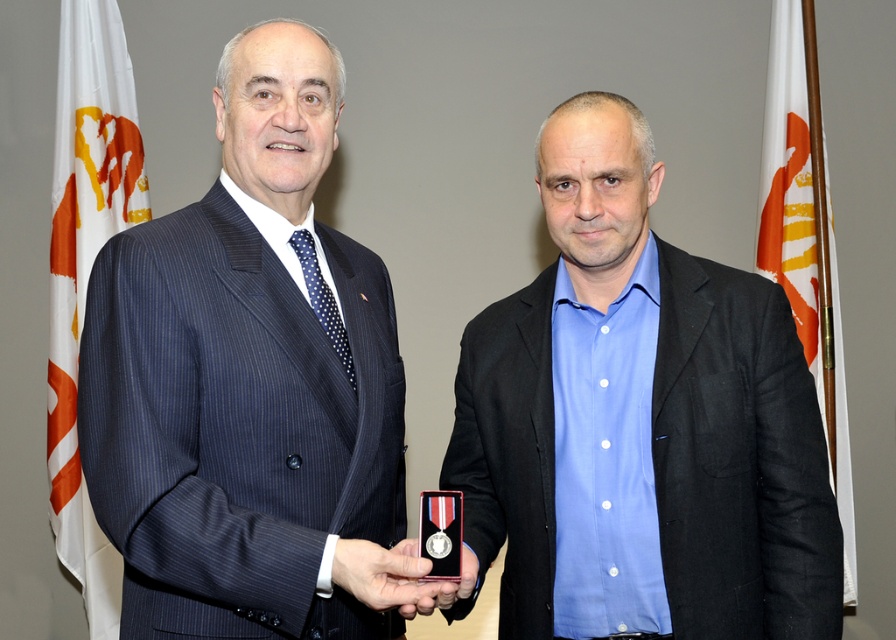
Is dark blue pinstripe suit at center behind white fabric flag at left?

No, it is not.

Measure the distance between point [317,168] and camera.

Point [317,168] and camera are 4.96 feet apart from each other.

Find the location of a particular element. dark blue pinstripe suit at center is located at coordinates (251, 385).

Where is `dark blue pinstripe suit at center`? Image resolution: width=896 pixels, height=640 pixels. dark blue pinstripe suit at center is located at coordinates (251, 385).

Can you confirm if dark blue pinstripe suit at center is wider than blue matte shirt at center?

In fact, dark blue pinstripe suit at center might be narrower than blue matte shirt at center.

I want to click on dark blue pinstripe suit at center, so point(251,385).

Which is below, dark blue pinstripe suit at center or white fabric flag at right?

dark blue pinstripe suit at center

Is dark blue pinstripe suit at center further to camera compared to white fabric flag at right?

No.

This screenshot has width=896, height=640. What are the coordinates of `dark blue pinstripe suit at center` in the screenshot? It's located at (251, 385).

The height and width of the screenshot is (640, 896). What are the coordinates of `dark blue pinstripe suit at center` in the screenshot? It's located at (251, 385).